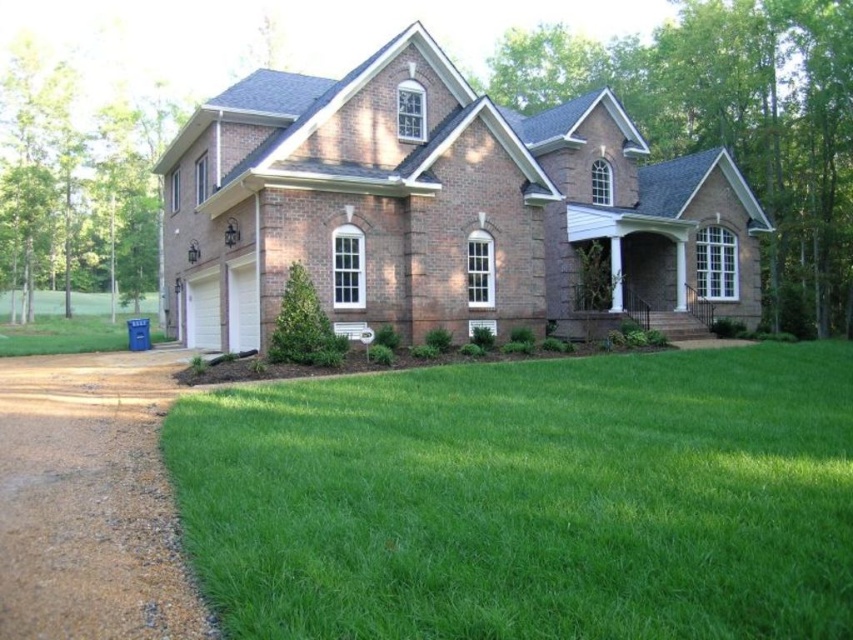
Question: Among these objects, which one is nearest to the camera?

Choices:
 (A) green grass at lower center
 (B) brown gravel driveway at lower left

Answer: (A)

Question: Is green grass at lower center thinner than brown gravel driveway at lower left?

Choices:
 (A) yes
 (B) no

Answer: (B)

Question: From the image, what is the correct spatial relationship of green grass at lower center in relation to brown gravel driveway at lower left?

Choices:
 (A) right
 (B) left

Answer: (A)

Question: Among these points, which one is farthest from the camera?

Choices:
 (A) (729, 522)
 (B) (100, 365)

Answer: (B)

Question: Is green grass at lower center positioned before brown gravel driveway at lower left?

Choices:
 (A) yes
 (B) no

Answer: (A)